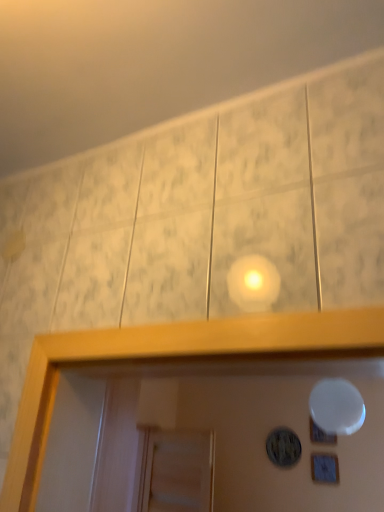
Describe the element at coordinates (325, 468) in the screenshot. I see `wooden frame at lower right` at that location.

Find the location of a particular element. matte black circular object at center, which is the first dot in left-to-right order is located at coordinates (283, 447).

This screenshot has height=512, width=384. What do you see at coordinates (337, 407) in the screenshot?
I see `white glossy mirror at upper center` at bounding box center [337, 407].

At what (x,y) coordinates should I click in order to perform the action: click on wooden frame at lower right. Please return your answer as a coordinate pair (x, y). This screenshot has width=384, height=512. Looking at the image, I should click on tap(325, 468).

Does white glossy plate at upper center, marked as the 2th dot in a left-to-right arrangement, appear on the right side of matte black circular object at center, which is the first dot in left-to-right order?

Correct, you'll find white glossy plate at upper center, marked as the 2th dot in a left-to-right arrangement, to the right of matte black circular object at center, which is the first dot in left-to-right order.

In the image, there is a matte black circular object at center, which is the first dot in left-to-right order. Where is `dot above it (from the image's perspective)`? The width and height of the screenshot is (384, 512). dot above it (from the image's perspective) is located at coordinates (320, 435).

How many degrees apart are the facing directions of white glossy plate at upper center, marked as the 2th dot in a left-to-right arrangement, and matte black circular object at center, which is the first dot in left-to-right order?

They differ by 0.0132 degrees in their facing directions.

Between matte black circular object at center, marked as the 2th dot in a right-to-left arrangement, and white glossy plate at upper center, the first dot positioned from the right, which one has smaller width?

white glossy plate at upper center, the first dot positioned from the right.

From a real-world perspective, is matte black circular object at center, marked as the 2th dot in a right-to-left arrangement, positioned above or below white glossy plate at upper center, the first dot positioned from the right?

From a real-world perspective, matte black circular object at center, marked as the 2th dot in a right-to-left arrangement, is physically below white glossy plate at upper center, the first dot positioned from the right.

Is white glossy plate at upper center, marked as the 2th dot in a left-to-right arrangement, at the back of matte black circular object at center, marked as the 2th dot in a right-to-left arrangement?

No, white glossy plate at upper center, marked as the 2th dot in a left-to-right arrangement, is not at the back of matte black circular object at center, marked as the 2th dot in a right-to-left arrangement.

How different are the orientations of matte black circular object at center, which is the first dot in left-to-right order, and white glossy plate at upper center, marked as the 2th dot in a left-to-right arrangement, in degrees?

The angular difference between matte black circular object at center, which is the first dot in left-to-right order, and white glossy plate at upper center, marked as the 2th dot in a left-to-right arrangement, is 0.0132 degrees.

Is wooden frame at lower right taller or shorter than white glossy mirror at upper center?

Considering their sizes, wooden frame at lower right has less height than white glossy mirror at upper center.

From the image's perspective, is wooden frame at lower right located above or below white glossy mirror at upper center?

wooden frame at lower right is situated lower than white glossy mirror at upper center in the image.

Could you tell me if wooden frame at lower right is turned towards white glossy mirror at upper center?

Yes, wooden frame at lower right is facing white glossy mirror at upper center.

Are wooden frame at lower right and white glossy mirror at upper center far apart?

Yes, wooden frame at lower right and white glossy mirror at upper center are located far from each other.

Which of these two, matte black circular object at center, marked as the 2th dot in a right-to-left arrangement, or white glossy mirror at upper center, is bigger?

white glossy mirror at upper center is bigger.

Are matte black circular object at center, marked as the 2th dot in a right-to-left arrangement, and white glossy mirror at upper center beside each other?

No, matte black circular object at center, marked as the 2th dot in a right-to-left arrangement, is not beside white glossy mirror at upper center.

How many degrees apart are the facing directions of matte black circular object at center, marked as the 2th dot in a right-to-left arrangement, and white glossy mirror at upper center?

They differ by 5.09 degrees in their facing directions.

From a real-world perspective, is matte black circular object at center, marked as the 2th dot in a right-to-left arrangement, physically above white glossy mirror at upper center?

No, from a real-world perspective, matte black circular object at center, marked as the 2th dot in a right-to-left arrangement, is not on top of white glossy mirror at upper center.

Does point (324, 437) come behind point (359, 395)?

Yes, point (324, 437) is farther from viewer.

From the image's perspective, is white glossy plate at upper center, marked as the 2th dot in a left-to-right arrangement, located beneath white glossy mirror at upper center?

Yes, from the image's perspective, white glossy plate at upper center, marked as the 2th dot in a left-to-right arrangement, is beneath white glossy mirror at upper center.

Can you tell me how much white glossy plate at upper center, the first dot positioned from the right, and white glossy mirror at upper center differ in facing direction?

white glossy plate at upper center, the first dot positioned from the right, and white glossy mirror at upper center are facing 5.09 degrees away from each other.

Which of these two, white glossy mirror at upper center or wooden frame at lower right, is thinner?

wooden frame at lower right.

Is white glossy mirror at upper center shorter than wooden frame at lower right?

No, white glossy mirror at upper center is not shorter than wooden frame at lower right.

Could you tell me if white glossy mirror at upper center is facing wooden frame at lower right?

No, white glossy mirror at upper center is not facing towards wooden frame at lower right.

Measure the distance between white glossy mirror at upper center and wooden frame at lower right.

white glossy mirror at upper center is 4.15 feet away from wooden frame at lower right.

Which is in front, point (310, 438) or point (325, 465)?

Positioned in front is point (325, 465).

Considering the sizes of objects white glossy plate at upper center, the first dot positioned from the right, and wooden frame at lower right in the image provided, who is wider, white glossy plate at upper center, the first dot positioned from the right, or wooden frame at lower right?

wooden frame at lower right.

Is white glossy plate at upper center, marked as the 2th dot in a left-to-right arrangement, turned away from wooden frame at lower right?

No, white glossy plate at upper center, marked as the 2th dot in a left-to-right arrangement, is not facing away from wooden frame at lower right.

Is white glossy plate at upper center, the first dot positioned from the right, bigger or smaller than wooden frame at lower right?

Considering their sizes, white glossy plate at upper center, the first dot positioned from the right, takes up more space than wooden frame at lower right.

You are a GUI agent. You are given a task and a screenshot of the screen. Output one action in this format:
    pyautogui.click(x=<x>, y=<y>)
    Task: Click on the dot on the right side of matte black circular object at center, which is the first dot in left-to-right order
    The image size is (384, 512).
    Given the screenshot: What is the action you would take?
    pyautogui.click(x=320, y=435)

The height and width of the screenshot is (512, 384). What are the coordinates of `dot in front of the matte black circular object at center, marked as the 2th dot in a right-to-left arrangement` in the screenshot? It's located at (320, 435).

Based on their spatial positions, is wooden frame at lower right or white glossy plate at upper center, the first dot positioned from the right, closer to white glossy mirror at upper center?

white glossy plate at upper center, the first dot positioned from the right, is closer to white glossy mirror at upper center.

From the image, which object appears to be farther from matte black circular object at center, which is the first dot in left-to-right order, wooden frame at lower right or white glossy plate at upper center, the first dot positioned from the right?

wooden frame at lower right lies further to matte black circular object at center, which is the first dot in left-to-right order, than the other object.

Based on the photo, estimate the real-world distances between objects in this image. Which object is closer to wooden frame at lower right, matte black circular object at center, which is the first dot in left-to-right order, or white glossy mirror at upper center?

matte black circular object at center, which is the first dot in left-to-right order, is closer to wooden frame at lower right.

Estimate the real-world distances between objects in this image. Which object is closer to matte black circular object at center, marked as the 2th dot in a right-to-left arrangement, wooden frame at lower right or white glossy mirror at upper center?

The object closer to matte black circular object at center, marked as the 2th dot in a right-to-left arrangement, is wooden frame at lower right.

From the image, which object appears to be farther from matte black circular object at center, marked as the 2th dot in a right-to-left arrangement, white glossy plate at upper center, marked as the 2th dot in a left-to-right arrangement, or wooden frame at lower right?

Based on the image, wooden frame at lower right appears to be further to matte black circular object at center, marked as the 2th dot in a right-to-left arrangement.

From the picture: From the image, which object appears to be nearer to white glossy plate at upper center, the first dot positioned from the right, wooden frame at lower right or matte black circular object at center, marked as the 2th dot in a right-to-left arrangement?

Based on the image, wooden frame at lower right appears to be nearer to white glossy plate at upper center, the first dot positioned from the right.

Based on their spatial positions, is matte black circular object at center, marked as the 2th dot in a right-to-left arrangement, or white glossy plate at upper center, the first dot positioned from the right, further from wooden frame at lower right?

matte black circular object at center, marked as the 2th dot in a right-to-left arrangement.

Considering their positions, is white glossy plate at upper center, the first dot positioned from the right, positioned closer to wooden frame at lower right than matte black circular object at center, which is the first dot in left-to-right order?

Based on the image, white glossy plate at upper center, the first dot positioned from the right, appears to be nearer to wooden frame at lower right.

Image resolution: width=384 pixels, height=512 pixels. I want to click on dot between white glossy mirror at upper center and matte black circular object at center, marked as the 2th dot in a right-to-left arrangement, along the z-axis, so click(x=320, y=435).

The width and height of the screenshot is (384, 512). I want to click on picture frame positioned between white glossy mirror at upper center and matte black circular object at center, marked as the 2th dot in a right-to-left arrangement, from near to far, so click(325, 468).

This screenshot has height=512, width=384. Find the location of `picture frame located between matte black circular object at center, which is the first dot in left-to-right order, and white glossy plate at upper center, the first dot positioned from the right, in the left-right direction`. picture frame located between matte black circular object at center, which is the first dot in left-to-right order, and white glossy plate at upper center, the first dot positioned from the right, in the left-right direction is located at coordinates (325, 468).

Identify the location of picture frame between white glossy mirror at upper center and white glossy plate at upper center, the first dot positioned from the right, along the z-axis. (325, 468).